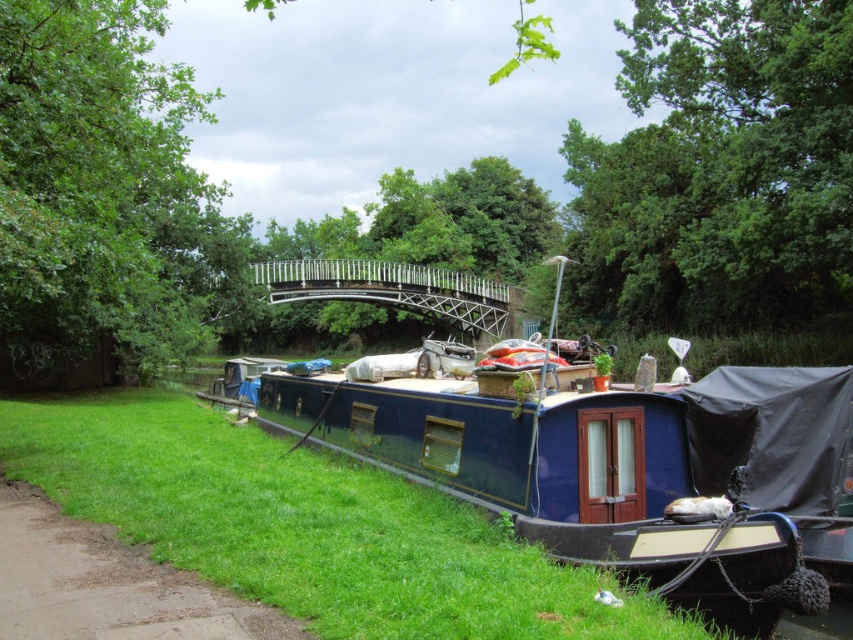
Does point (137, 522) come behind point (289, 276)?

No.

Who is taller, green grass at lower left or metallic silver bridge at center?

metallic silver bridge at center

Where is `green grass at lower left`? This screenshot has height=640, width=853. green grass at lower left is located at coordinates (310, 525).

Find the location of `green grass at lower left`. green grass at lower left is located at coordinates (310, 525).

Is blue glossy boat at center to the right of green grass at lower left from the viewer's perspective?

Indeed, blue glossy boat at center is positioned on the right side of green grass at lower left.

Is blue glossy boat at center positioned in front of green grass at lower left?

No, blue glossy boat at center is further to the viewer.

Find the location of a particular element. This screenshot has width=853, height=640. blue glossy boat at center is located at coordinates (575, 467).

Locate an element on the screen. This screenshot has width=853, height=640. blue glossy boat at center is located at coordinates (575, 467).

Does blue glossy boat at center have a lesser width compared to metallic silver bridge at center?

No, blue glossy boat at center is not thinner than metallic silver bridge at center.

Who is positioned more to the left, blue glossy boat at center or metallic silver bridge at center?

Positioned to the left is metallic silver bridge at center.

Describe the element at coordinates (575, 467) in the screenshot. I see `blue glossy boat at center` at that location.

In order to click on blue glossy boat at center in this screenshot , I will do `click(575, 467)`.